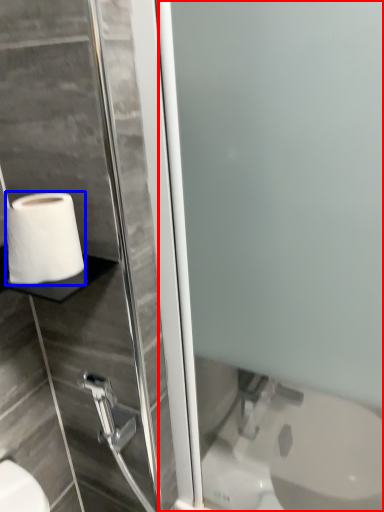
Question: Among these objects, which one is nearest to the camera, screen door (highlighted by a red box) or toilet paper (highlighted by a blue box)?

Choices:
 (A) screen door
 (B) toilet paper

Answer: (A)